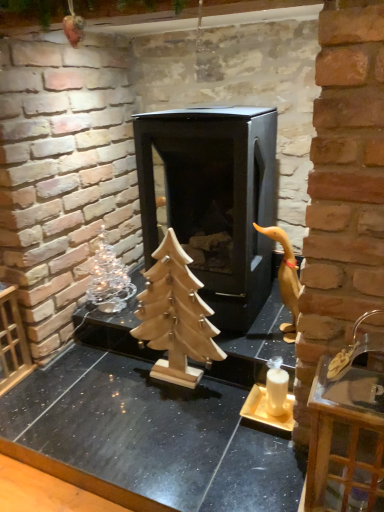
Question: Considering the positions of wooden tree at center and white matte candle holder at lower right in the image, is wooden tree at center taller or shorter than white matte candle holder at lower right?

Choices:
 (A) tall
 (B) short

Answer: (B)

Question: Is wooden tree at center spatially inside white matte candle holder at lower right, or outside of it?

Choices:
 (A) outside
 (B) inside

Answer: (A)

Question: Which is farther from the silver metallic christmas tree at left?

Choices:
 (A) black matte fireplace at center
 (B) wooden tree at center
 (C) clear glass tray at right
 (D) wooden christmas tree at center
 (E) white matte candle holder at lower right

Answer: (C)

Question: Estimate the real-world distances between objects in this image. Which object is closer to the black matte fireplace at center?

Choices:
 (A) wooden tree at center
 (B) wooden christmas tree at center
 (C) wooden duckling at right
 (D) silver metallic christmas tree at left
 (E) clear glass tray at right

Answer: (C)